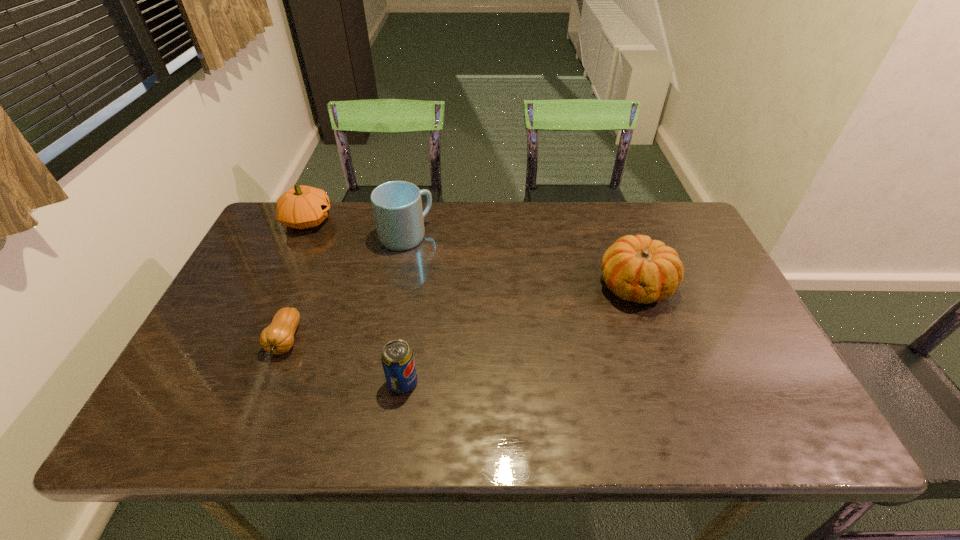
Locate an element on the screen. The height and width of the screenshot is (540, 960). mug is located at coordinates (397, 206).

Identify the location of the farthest gourd. (301, 207).

Image resolution: width=960 pixels, height=540 pixels. Identify the location of the rightmost gourd. (636, 268).

Locate an element on the screen. the second nearest gourd is located at coordinates (636, 268).

Image resolution: width=960 pixels, height=540 pixels. In order to click on soda in this screenshot , I will do `click(397, 358)`.

Locate an element on the screen. the nearest gourd is located at coordinates (278, 338).

The height and width of the screenshot is (540, 960). In order to click on the shortest gourd in this screenshot , I will do `click(278, 338)`.

Where is `free space located on the right of the mug`? This screenshot has height=540, width=960. free space located on the right of the mug is located at coordinates (465, 237).

At what (x,y) coordinates should I click in order to perform the action: click on vacant space located 0.320m on the side of the farthest gourd with the carved face. Please return your answer as a coordinate pair (x, y). Looking at the image, I should click on (433, 220).

Where is `vacant space located 0.160m on the left of the third farthest object`? vacant space located 0.160m on the left of the third farthest object is located at coordinates (540, 286).